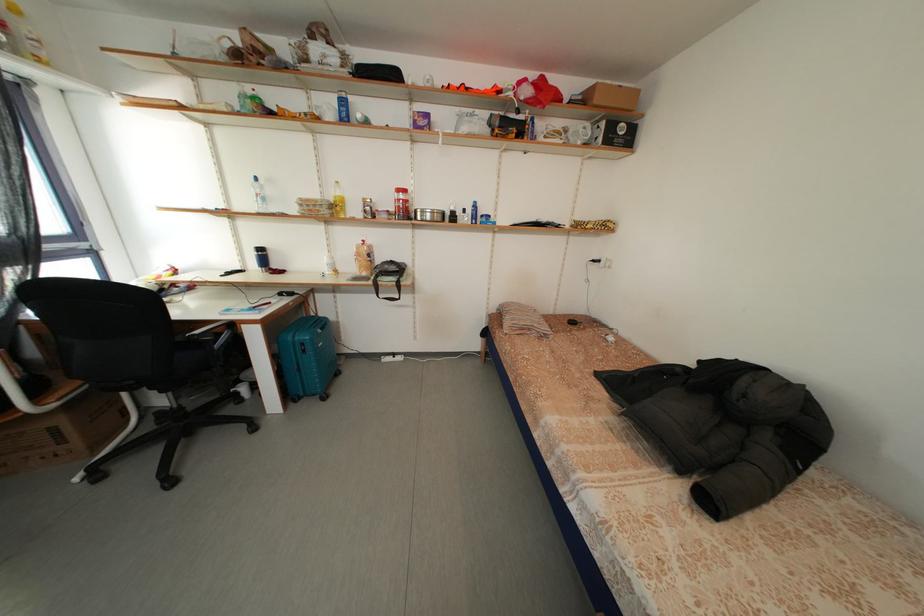
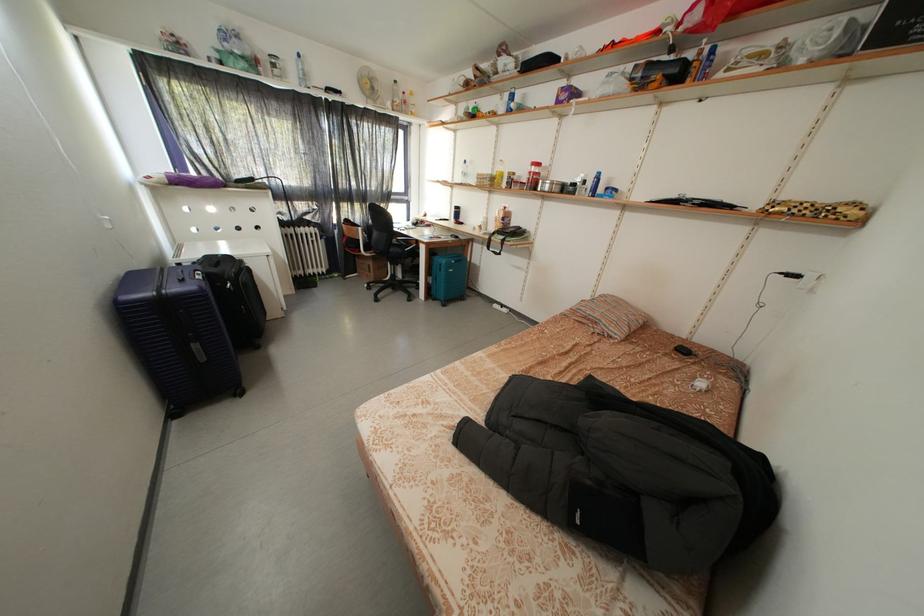
Where in the second image is the point corresponding to point 436,222 from the first image?

(554, 193)